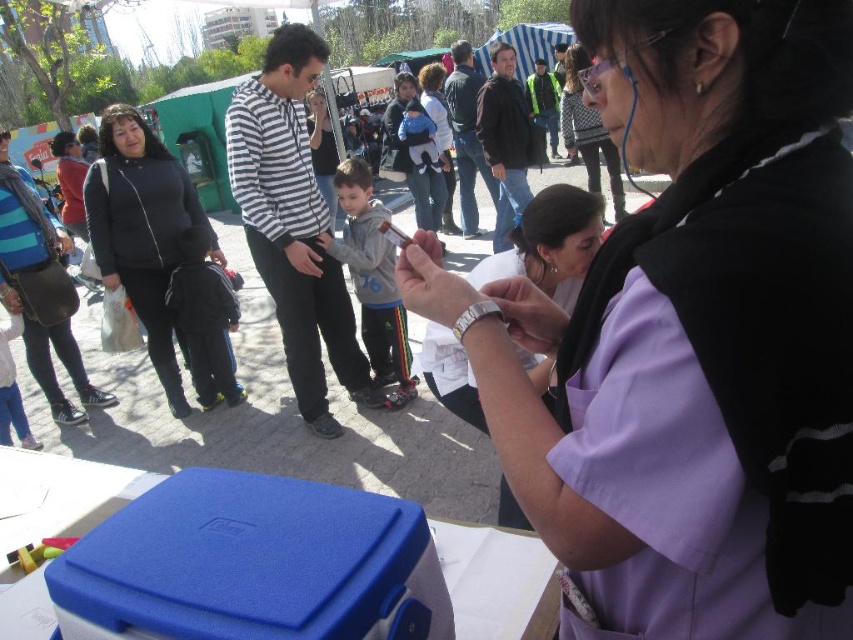
Does purple fabric shirt at center have a smaller size compared to matte purple shirt at center?

Indeed, purple fabric shirt at center has a smaller size compared to matte purple shirt at center.

Which is behind, point (701, 538) or point (599, 177)?

Point (599, 177)

Is point (637, 436) positioned after point (566, 65)?

No, (637, 436) is in front of (566, 65).

Identify the location of purple fabric shirt at center. Image resolution: width=853 pixels, height=640 pixels. (691, 336).

Is the position of purple fabric shirt at center less distant than that of dark gray fleece jacket at center?

Yes, it is in front of dark gray fleece jacket at center.

Describe the element at coordinates (691, 336) in the screenshot. I see `purple fabric shirt at center` at that location.

Locate an element on the screen. The image size is (853, 640). purple fabric shirt at center is located at coordinates (691, 336).

Can you confirm if black soft jacket at left is bigger than dark gray fleece jacket at center?

Yes, black soft jacket at left is bigger than dark gray fleece jacket at center.

Does black soft jacket at left have a lesser height compared to dark gray fleece jacket at center?

In fact, black soft jacket at left may be taller than dark gray fleece jacket at center.

This screenshot has width=853, height=640. What are the coordinates of `black soft jacket at left` in the screenshot? It's located at (155, 252).